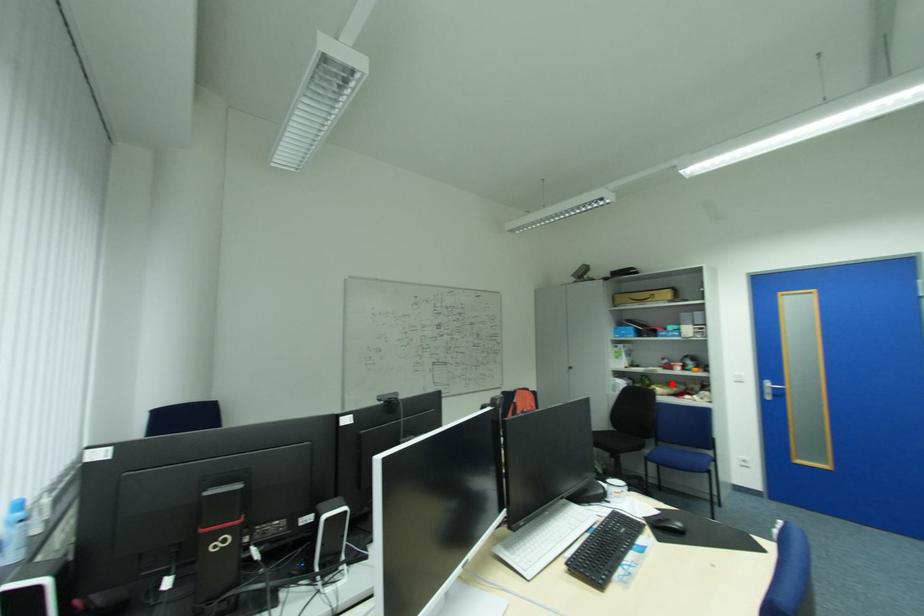
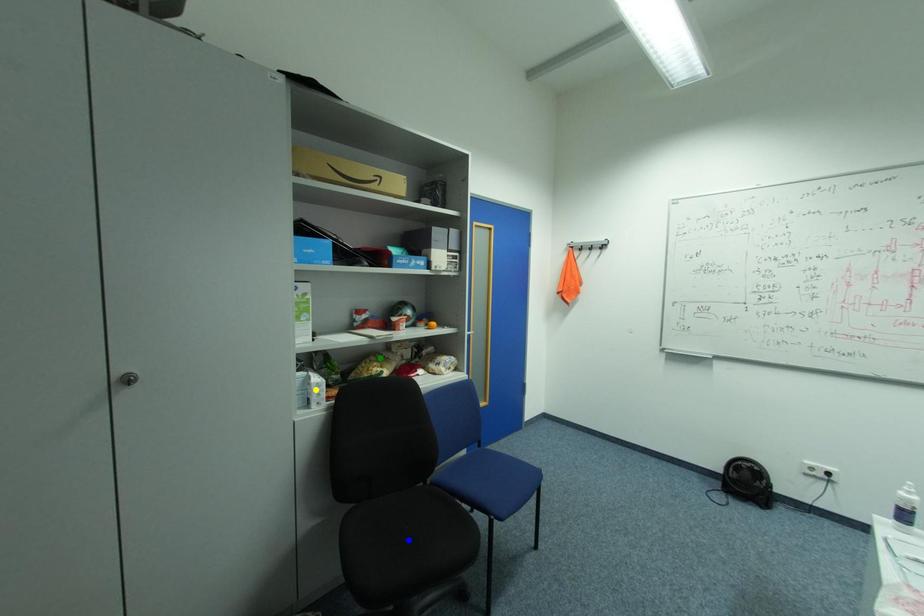
Question: I am providing you with two images of the same scene from different viewpoints. A red point is marked on the first image. You are given multiple points on the second image. Which mark in image 2 goes with the point in image 1?

Choices:
 (A) green point
 (B) yellow point
 (C) blue point

Answer: (A)